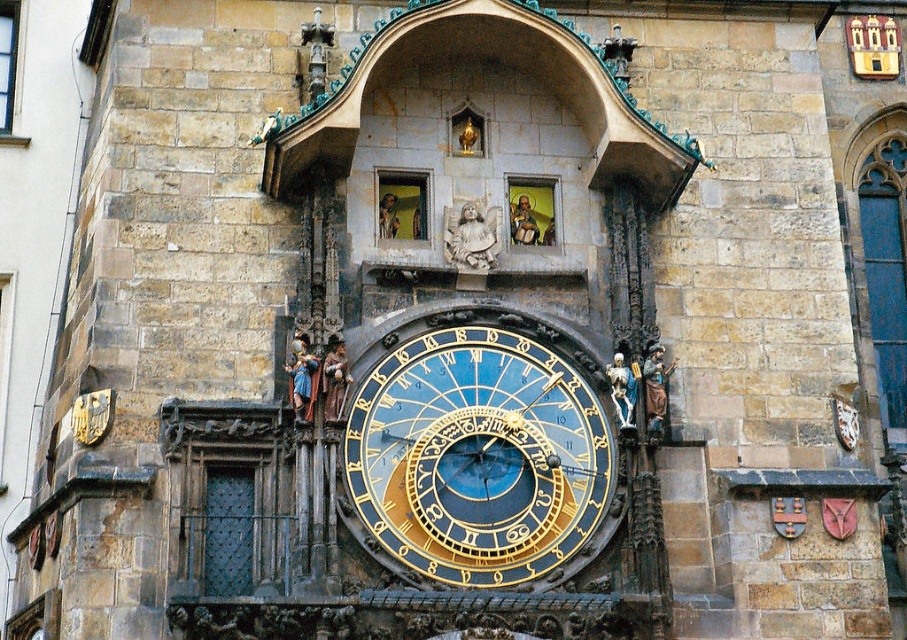
You are an architect examining the historic building. You notice the gold metallic clock at center and the stone statue of an angel at center. Which object is wider?

The gold metallic clock at center is wider than the stone statue of an angel at center.

You are an architect examining the historic building. You notice the gold metallic clock at center and the stone statue of an angel at center. Which object occupies more space in the scene?

The gold metallic clock at center is larger in size than the stone statue of an angel at center, so it occupies more space in the scene.